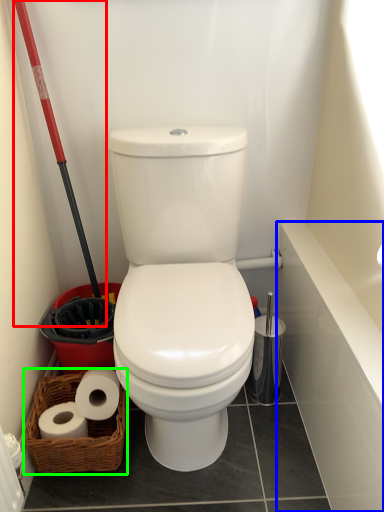
Question: Based on their relative distances, which object is farther from shovel (highlighted by a red box)? Choose from bath (highlighted by a blue box) and basket (highlighted by a green box).

Choices:
 (A) bath
 (B) basket

Answer: (A)